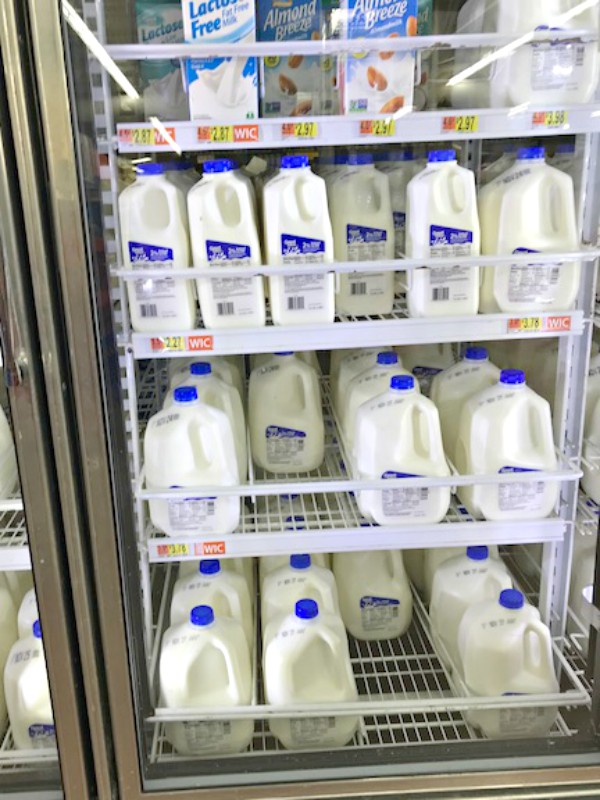
At what (x,y) coordinates should I click in order to perform the action: click on gallon jugs on bottom shelf on right. Please return your answer as a coordinate pair (x, y). Looking at the image, I should click on (193, 681), (223, 592), (234, 566), (318, 558), (291, 584), (304, 649), (370, 574), (436, 556), (451, 592), (492, 638).